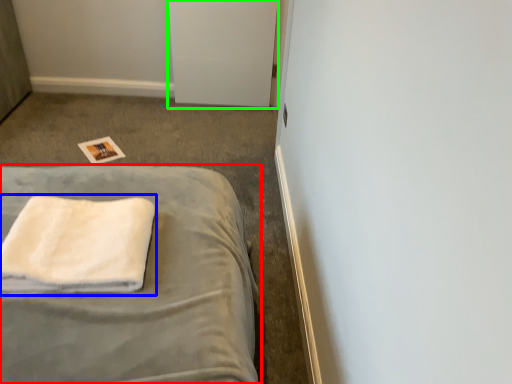
Question: Estimate the real-world distances between objects in this image. Which object is closer to bed (highlighted by a red box), towel (highlighted by a blue box) or file cabinet (highlighted by a green box)?

Choices:
 (A) towel
 (B) file cabinet

Answer: (A)